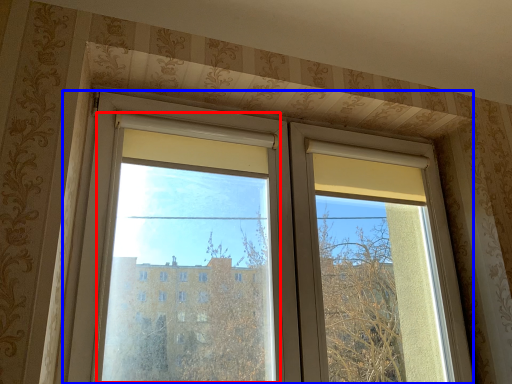
Question: Among these objects, which one is nearest to the camera, window screen (highlighted by a red box) or window (highlighted by a blue box)?

Choices:
 (A) window screen
 (B) window

Answer: (A)